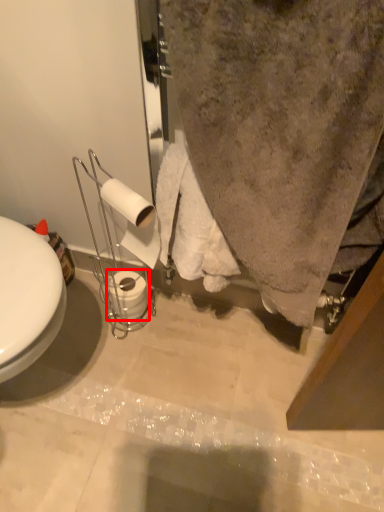
Question: From the image's perspective, what is the correct spatial relationship of toilet paper (annotated by the red box) in relation to toilet paper?

Choices:
 (A) above
 (B) below

Answer: (B)